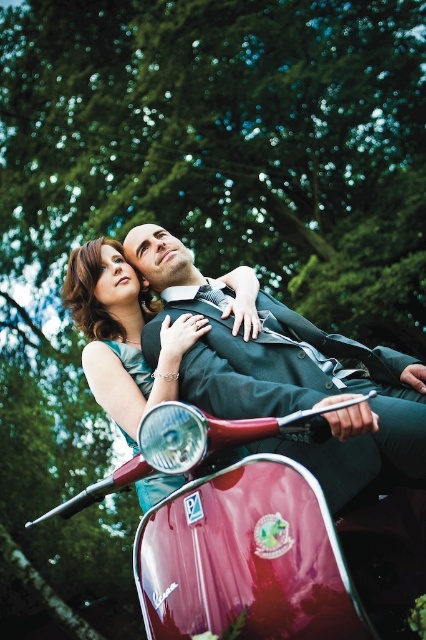
Question: Which is farther from the satin teal dress at lower left?

Choices:
 (A) glossy red scooter at center
 (B) shiny black suit at center

Answer: (B)

Question: Does glossy red scooter at center appear under satin teal dress at lower left?

Choices:
 (A) yes
 (B) no

Answer: (B)

Question: Which object is the farthest from the satin teal dress at lower left?

Choices:
 (A) glossy red scooter at center
 (B) shiny black suit at center

Answer: (B)

Question: Is shiny black suit at center behind satin teal dress at lower left?

Choices:
 (A) yes
 (B) no

Answer: (B)

Question: Does shiny black suit at center lie in front of satin teal dress at lower left?

Choices:
 (A) yes
 (B) no

Answer: (A)

Question: Which object appears closest to the camera in this image?

Choices:
 (A) shiny black suit at center
 (B) satin teal dress at lower left
 (C) glossy red scooter at center

Answer: (C)